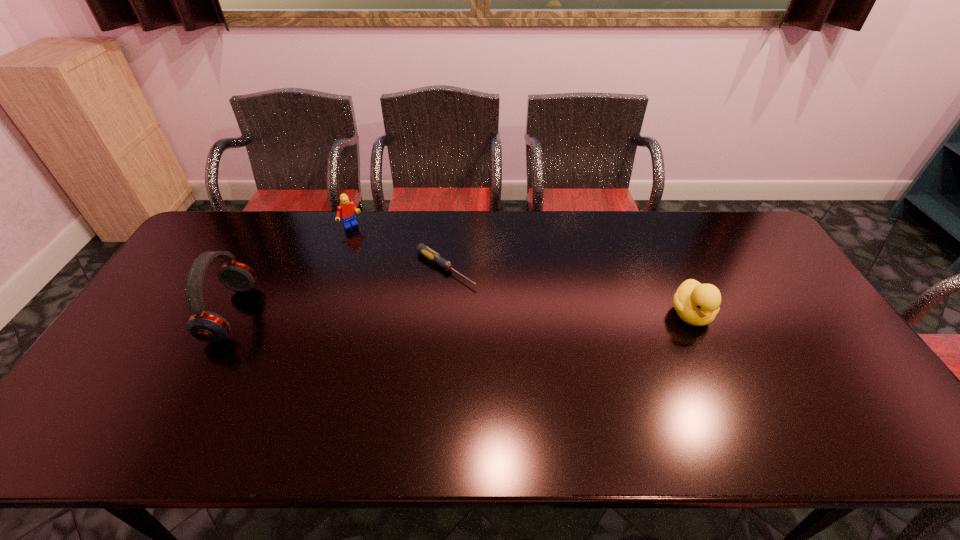
Identify the location of free space located insert the screwdriver into a screw head. (565, 346).

Image resolution: width=960 pixels, height=540 pixels. I want to click on vacant area situated 0.360m insert the screwdriver into a screw head, so click(x=565, y=346).

The image size is (960, 540). Find the location of `vacant space located 0.280m on the front-facing side of the Lego`. vacant space located 0.280m on the front-facing side of the Lego is located at coordinates (x=395, y=276).

Image resolution: width=960 pixels, height=540 pixels. In order to click on free space located 0.110m on the front-facing side of the Lego in this screenshot , I will do `click(371, 248)`.

Identify the location of free space located on the front-facing side of the Lego. (378, 258).

Locate an element on the screen. This screenshot has width=960, height=540. screwdriver present at the far edge is located at coordinates (422, 249).

I want to click on Lego present at the far edge, so click(346, 209).

Locate an element on the screen. The image size is (960, 540). vacant space at the far edge of the desktop is located at coordinates click(x=384, y=211).

You are a GUI agent. You are given a task and a screenshot of the screen. Output one action in this format:
    pyautogui.click(x=<x>, y=<y>)
    Task: Click on the vacant space at the near edge of the desktop
    Image resolution: width=960 pixels, height=540 pixels.
    Given the screenshot: What is the action you would take?
    pyautogui.click(x=447, y=384)

The image size is (960, 540). What are the coordinates of `vacant area at the right edge of the desktop` in the screenshot? It's located at (804, 337).